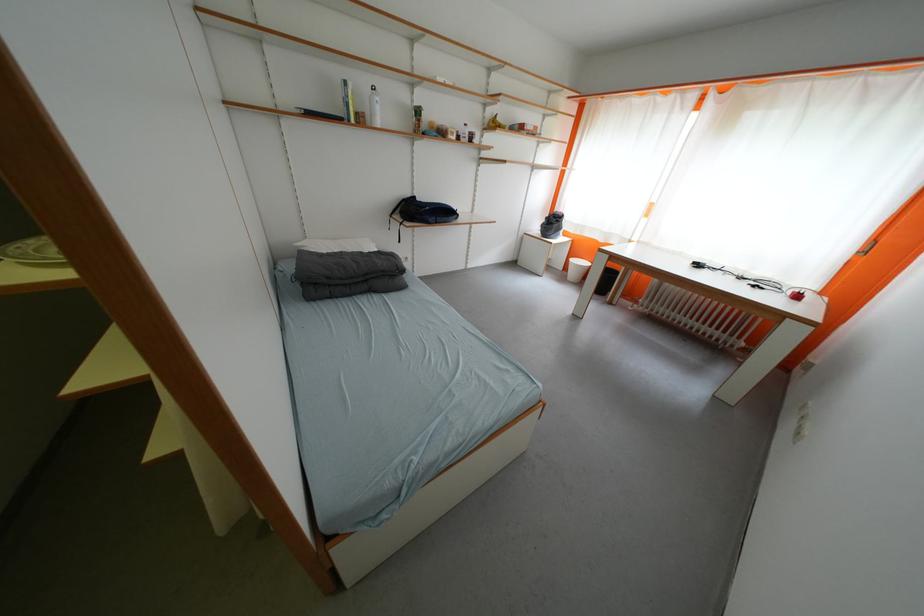
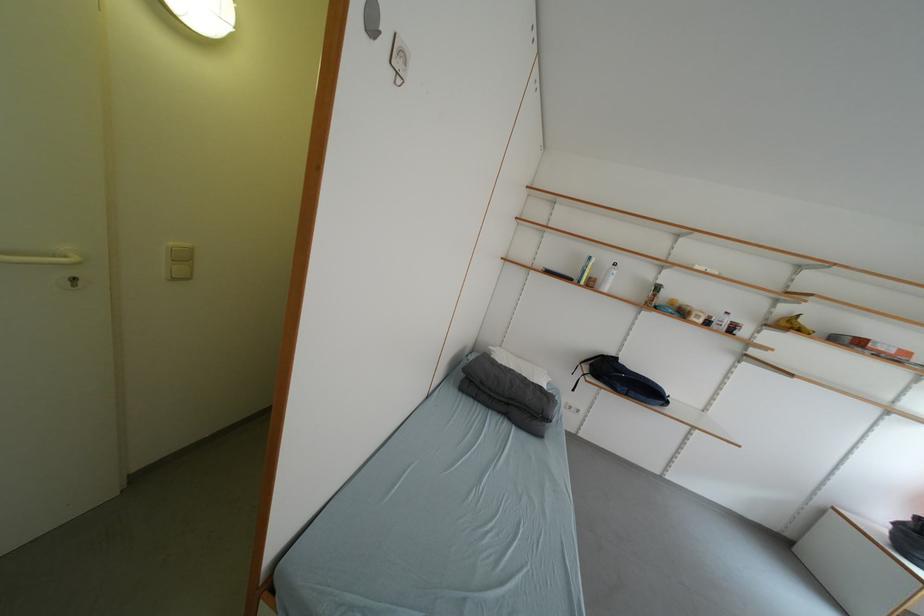
Question: The first image is from the beginning of the video and the second image is from the end. How did the camera likely rotate when shooting the video?

Choices:
 (A) Left
 (B) Right
 (C) Up
 (D) Down

Answer: (A)